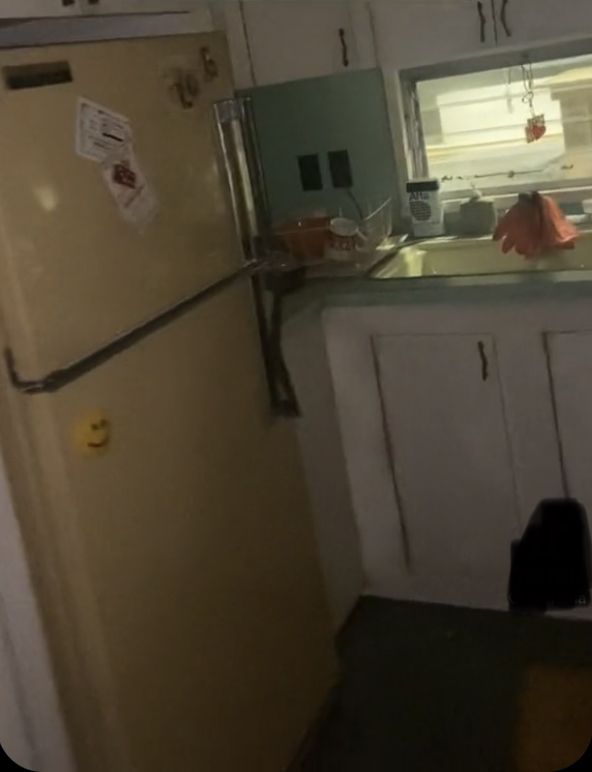
Identify the location of floor. (427, 674).